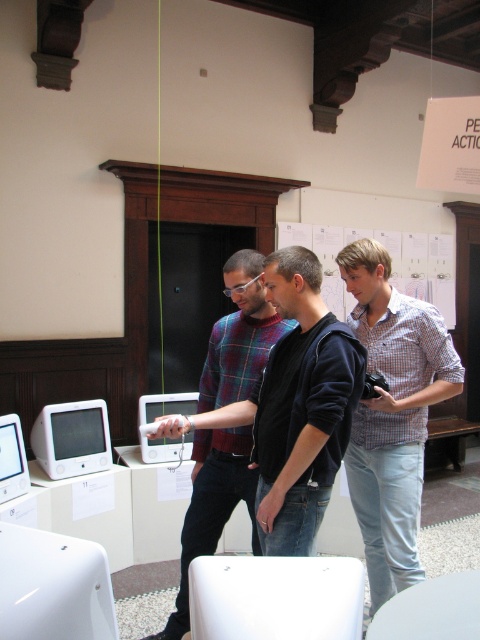
Question: Is light blue jeans at center closer to the viewer compared to white plastic monitor at lower left?

Choices:
 (A) no
 (B) yes

Answer: (B)

Question: Which of the following is the farthest from the observer?

Choices:
 (A) light blue jeans at center
 (B) white glossy monitor at left

Answer: (B)

Question: Which is farther from the plaid shirt at center?

Choices:
 (A) white plastic monitor at lower left
 (B) light blue jeans at center
 (C) white glossy computer at center
 (D) white glossy monitor at left

Answer: (D)

Question: Can you confirm if plaid shirt at center is bigger than white plastic monitor at lower left?

Choices:
 (A) yes
 (B) no

Answer: (A)

Question: Among these points, which one is nearest to the camera?

Choices:
 (A) (377, 307)
 (B) (43, 449)

Answer: (A)

Question: Does plaid shirt at center lie behind white glossy computer at center?

Choices:
 (A) no
 (B) yes

Answer: (A)